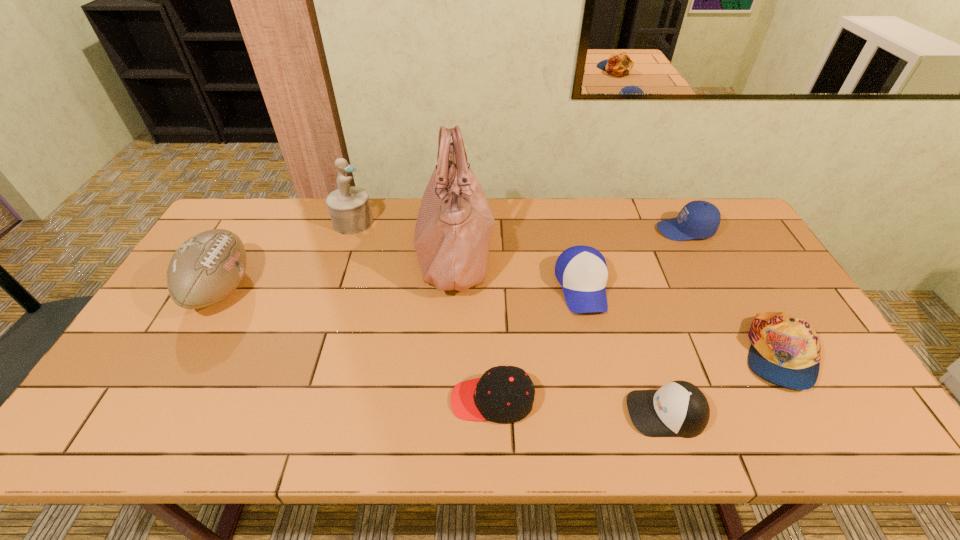
The height and width of the screenshot is (540, 960). I want to click on free space located 0.150m at the beak of the figurine, so click(417, 222).

The image size is (960, 540). Find the location of `vacant area situated 0.140m on the laces of the leftmost object`. vacant area situated 0.140m on the laces of the leftmost object is located at coordinates (299, 289).

Find the location of a particular element. The height and width of the screenshot is (540, 960). vacant space located 0.300m on the front-facing side of the farthest cap is located at coordinates (568, 230).

Identify the location of free space located on the front-facing side of the farthest cap. (636, 230).

Image resolution: width=960 pixels, height=540 pixels. Find the location of `vacant area situated on the front-facing side of the farthest cap`. vacant area situated on the front-facing side of the farthest cap is located at coordinates (568, 230).

The width and height of the screenshot is (960, 540). In order to click on free location located on the front-facing side of the baseball cap in this screenshot , I will do `click(594, 342)`.

Where is `free space located on the front-facing side of the leftmost cap`? free space located on the front-facing side of the leftmost cap is located at coordinates (282, 400).

Locate an element on the screen. This screenshot has width=960, height=540. vacant area located 0.240m on the front-facing side of the leftmost cap is located at coordinates (349, 400).

Find the location of a particular element. The height and width of the screenshot is (540, 960). vacant space situated 0.330m on the front-facing side of the leftmost cap is located at coordinates click(312, 400).

Locate an element on the screen. vacant space located 0.060m on the front panel of the second cap from left to right is located at coordinates click(601, 413).